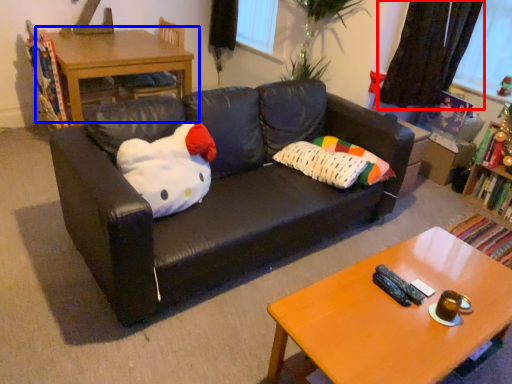
Question: Which of the following is the farthest to the observer, curtain (highlighted by a red box) or table (highlighted by a blue box)?

Choices:
 (A) curtain
 (B) table

Answer: (B)